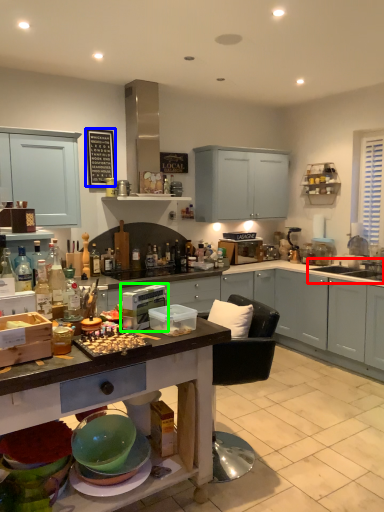
Question: Which object is positioned closest to sink (highlighted by a red box)? Select from bulletin board (highlighted by a blue box) and appliance (highlighted by a green box).

Choices:
 (A) bulletin board
 (B) appliance

Answer: (A)